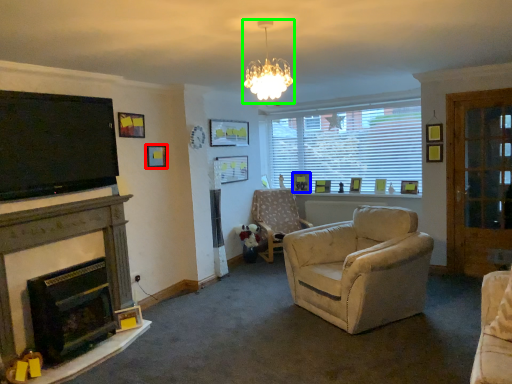
Question: Which object is the farthest from picture frame (highlighted by a red box)? Choose among these: picture frame (highlighted by a blue box) or light fixture (highlighted by a green box).

Choices:
 (A) picture frame
 (B) light fixture

Answer: (A)